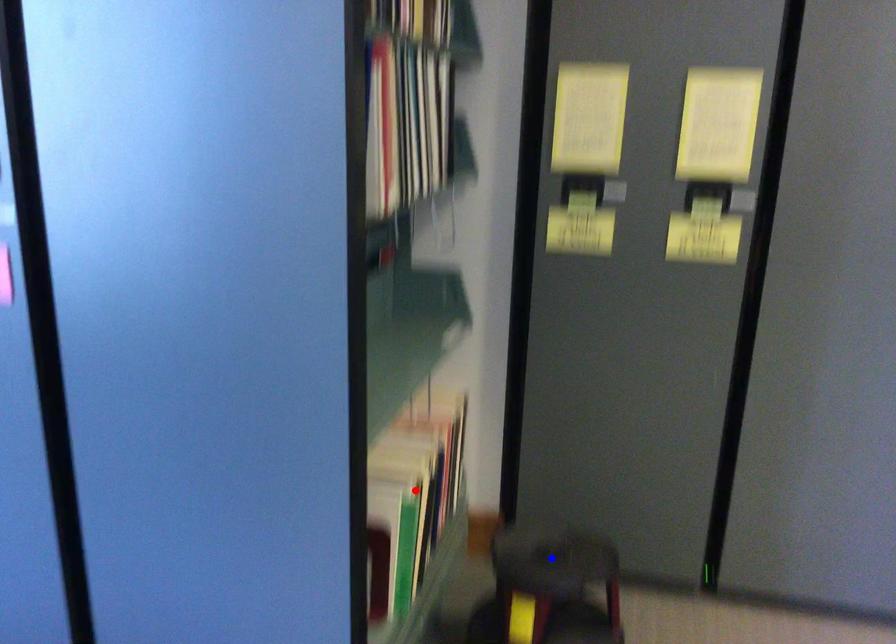
Question: Which of the two points in the image is closer to the camera?

Choices:
 (A) Blue point is closer.
 (B) Red point is closer.

Answer: (B)